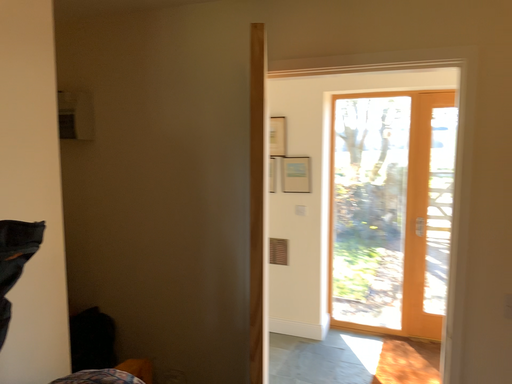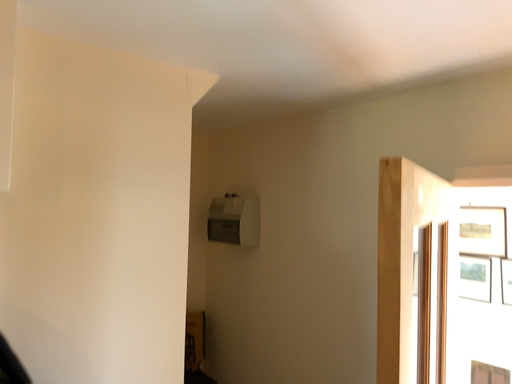
Question: Which way did the camera rotate in the video?

Choices:
 (A) rotated left
 (B) rotated right

Answer: (A)